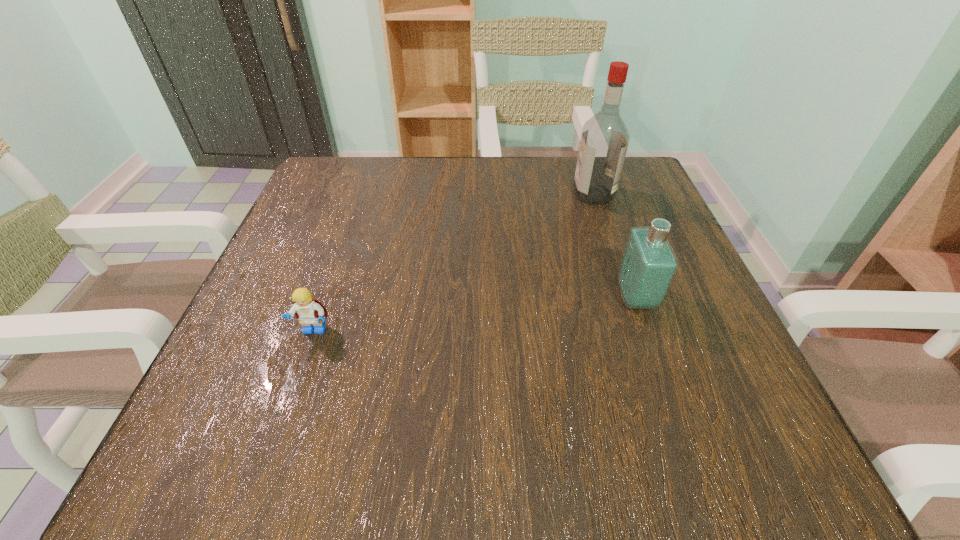
Image resolution: width=960 pixels, height=540 pixels. Identify the location of vacant space at the right edge of the desktop. (600, 237).

The image size is (960, 540). In order to click on free space at the far left corner of the desktop in this screenshot , I will do click(331, 172).

Identify the location of vacant region at the near left corner. This screenshot has width=960, height=540. (169, 471).

At what (x,y) coordinates should I click in order to perform the action: click on vacant space in between the tallest object and the perfume. Please return your answer as a coordinate pair (x, y). Looking at the image, I should click on (614, 246).

The height and width of the screenshot is (540, 960). I want to click on vacant space in between the perfume and the leftmost object, so click(x=475, y=315).

What are the coordinates of `vacant space that is in between the tallest object and the shortest object` in the screenshot? It's located at (x=454, y=263).

This screenshot has height=540, width=960. What are the coordinates of `vacant area between the second tallest object and the liquor` in the screenshot? It's located at (614, 246).

The width and height of the screenshot is (960, 540). What are the coordinates of `free space between the tallest object and the shortest object` in the screenshot? It's located at (454, 263).

The image size is (960, 540). What are the coordinates of `empty space that is in between the Lego and the second tallest object` in the screenshot? It's located at (475, 315).

Identify the location of vacant area that lies between the liquor and the perfume. The width and height of the screenshot is (960, 540). (614, 246).